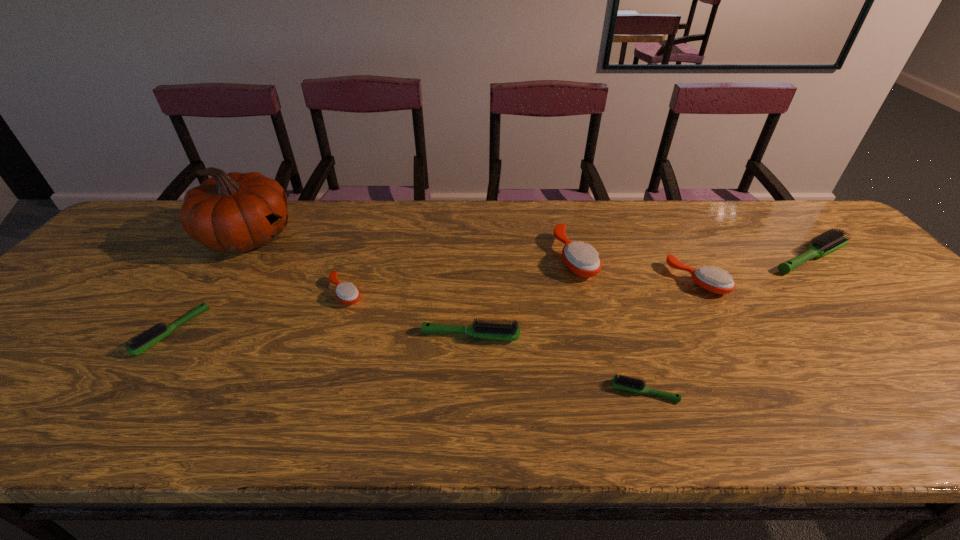
Image resolution: width=960 pixels, height=540 pixels. Identify the location of blank area located 0.230m on the back of the third hairbrush from left to right. (472, 265).

This screenshot has width=960, height=540. I want to click on vacant space located on the right of the third object from left to right, so click(x=454, y=292).

Locate an element on the screen. free space located 0.360m on the back of the leftmost hairbrush is located at coordinates (247, 225).

Locate an element on the screen. The height and width of the screenshot is (540, 960). free region located 0.280m on the left of the nearest hairbrush is located at coordinates (476, 392).

Identify the location of pumpkin that is at the far edge. The width and height of the screenshot is (960, 540). (236, 212).

Locate an element on the screen. The height and width of the screenshot is (540, 960). object located at the near edge is located at coordinates (622, 382).

Find the location of a particular element. This screenshot has height=540, width=960. object that is positioned at the right edge is located at coordinates (831, 240).

This screenshot has height=540, width=960. In order to click on object present at the far right corner in this screenshot , I will do `click(831, 240)`.

Find the location of `free location at the far edge`. free location at the far edge is located at coordinates (340, 215).

Find the location of a particular element. blank area at the near edge is located at coordinates pos(940,435).